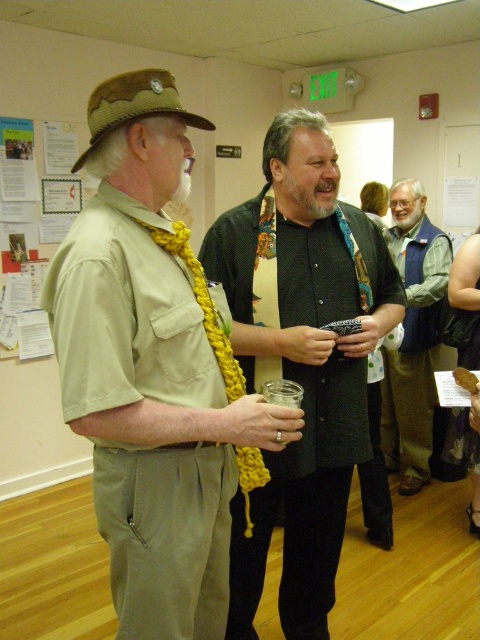
Is matte khaki shirt at left wider than blue-green vest at center-right?

Indeed, matte khaki shirt at left has a greater width compared to blue-green vest at center-right.

Who is higher up, matte khaki shirt at left or blue-green vest at center-right?

Positioned higher is blue-green vest at center-right.

What do you see at coordinates (154, 371) in the screenshot? I see `matte khaki shirt at left` at bounding box center [154, 371].

Locate an element on the screen. The image size is (480, 640). matte khaki shirt at left is located at coordinates (154, 371).

Can you confirm if black matte shirt at center is smaller than blue-green vest at center-right?

No.

Is black matte shirt at center bigger than blue-green vest at center-right?

Yes.

Describe the element at coordinates (301, 360) in the screenshot. I see `black matte shirt at center` at that location.

At what (x,y) coordinates should I click in order to perform the action: click on black matte shirt at center. Please return your answer as a coordinate pair (x, y). Looking at the image, I should click on (301, 360).

Which is more to the right, matte khaki shirt at left or black matte shirt at center?

From the viewer's perspective, black matte shirt at center appears more on the right side.

Between matte khaki shirt at left and black matte shirt at center, which one appears on the left side from the viewer's perspective?

Positioned to the left is matte khaki shirt at left.

Which is behind, point (214, 292) or point (250, 208)?

Positioned behind is point (250, 208).

Locate an element on the screen. The height and width of the screenshot is (640, 480). matte khaki shirt at left is located at coordinates (154, 371).